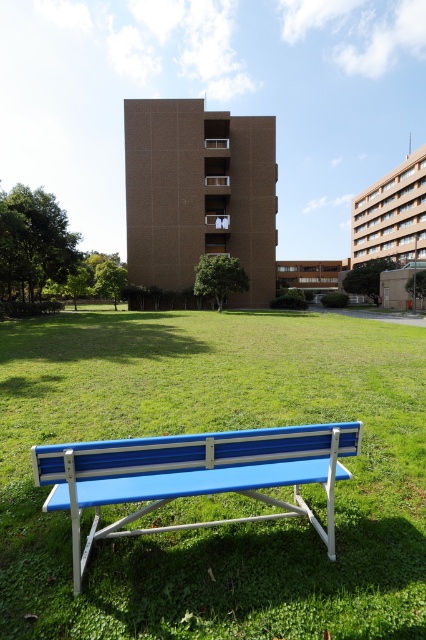
Between blue plastic bench at center and blue plastic bench at lower center, which one appears on the left side from the viewer's perspective?

Positioned to the left is blue plastic bench at lower center.

This screenshot has height=640, width=426. I want to click on blue plastic bench at center, so click(x=216, y=429).

Image resolution: width=426 pixels, height=640 pixels. In order to click on blue plastic bench at center in this screenshot , I will do `click(216, 429)`.